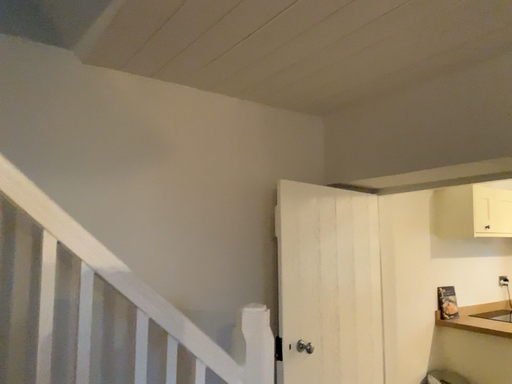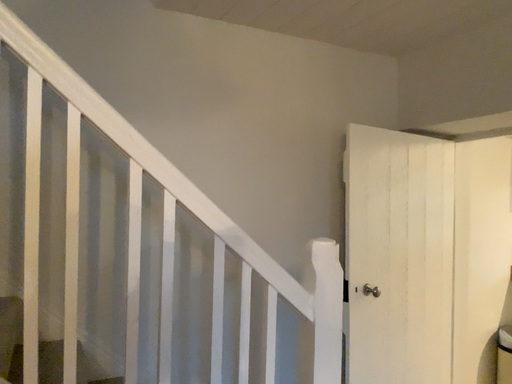
Question: How did the camera likely rotate when shooting the video?

Choices:
 (A) rotated left
 (B) rotated right

Answer: (A)